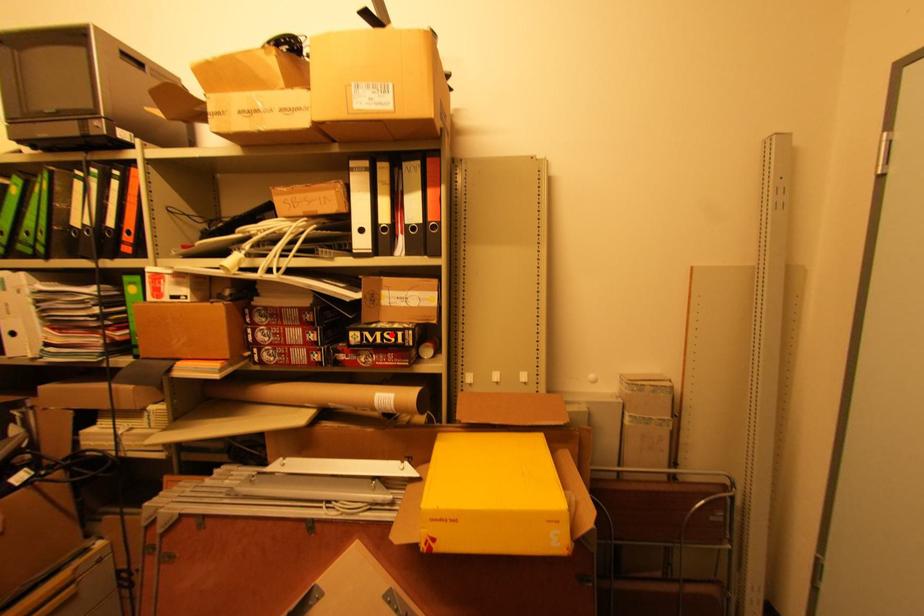
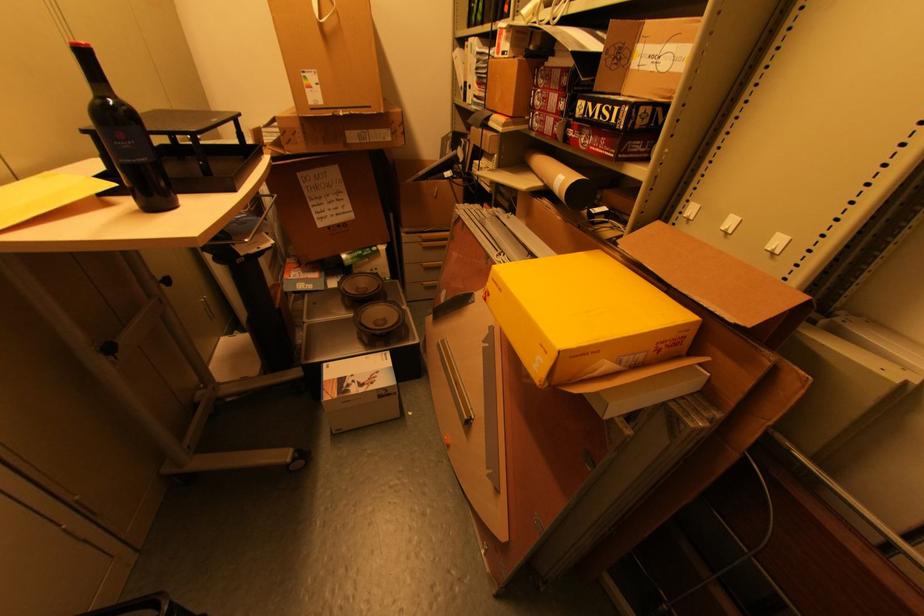
Where in the second image is the point corresponding to the highlighted location from the first image?

(610, 108)